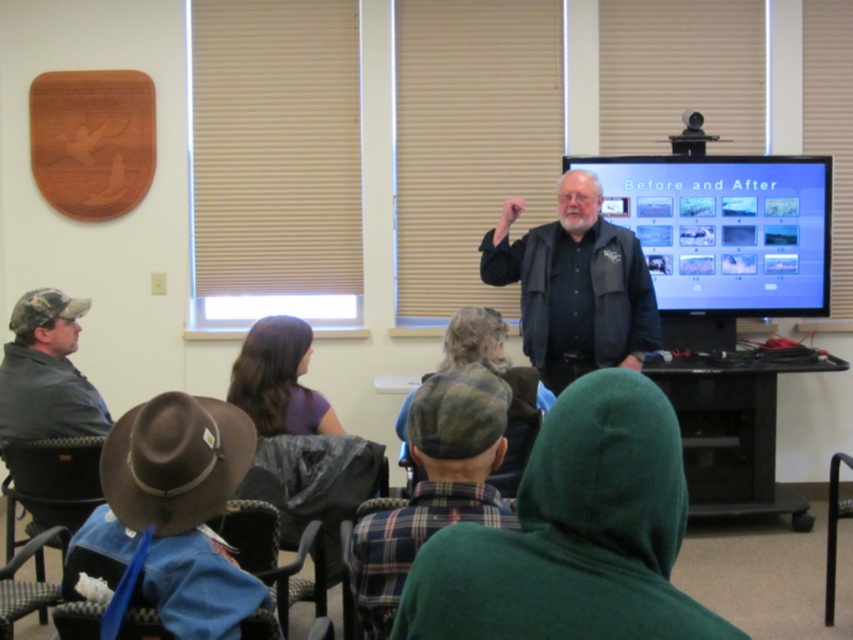
You are attending a presentation and notice two people in the front row wearing shirts with different patterns. The plaid fabric shirt at center and the camo fabric shirt at left. Which shirt is located to the right of the other?

The plaid fabric shirt at center is positioned on the right side of the camo fabric shirt at left.

You are organizing a treasure hunt in the presentation room. The first clue is hidden under a specific object. The clue says, The treasure is under the brown leather cowboy hat at lower left. Based on the scene description, where exactly should you look to find the treasure?

The treasure is under the brown leather cowboy hat at lower left located at point (173, 461).